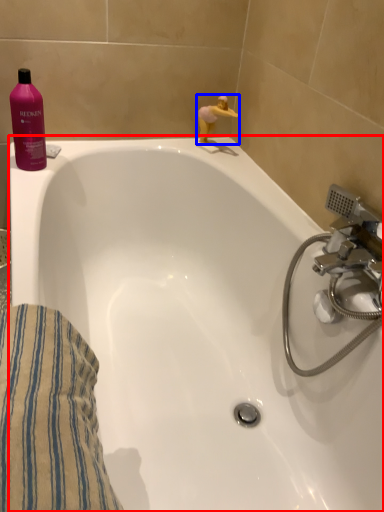
Question: Which point is further to the camera, bathtub (highlighted by a red box) or miniature (highlighted by a blue box)?

Choices:
 (A) bathtub
 (B) miniature

Answer: (B)